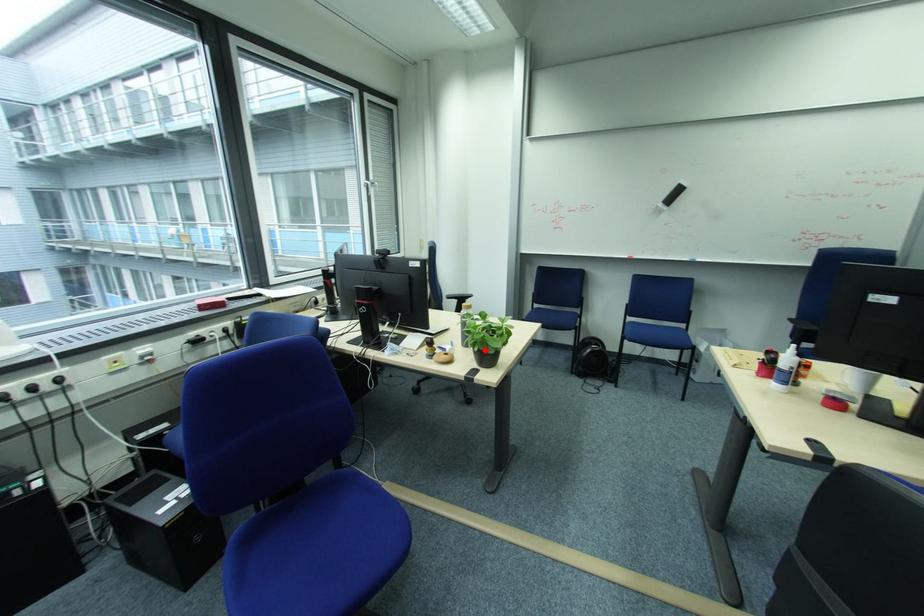
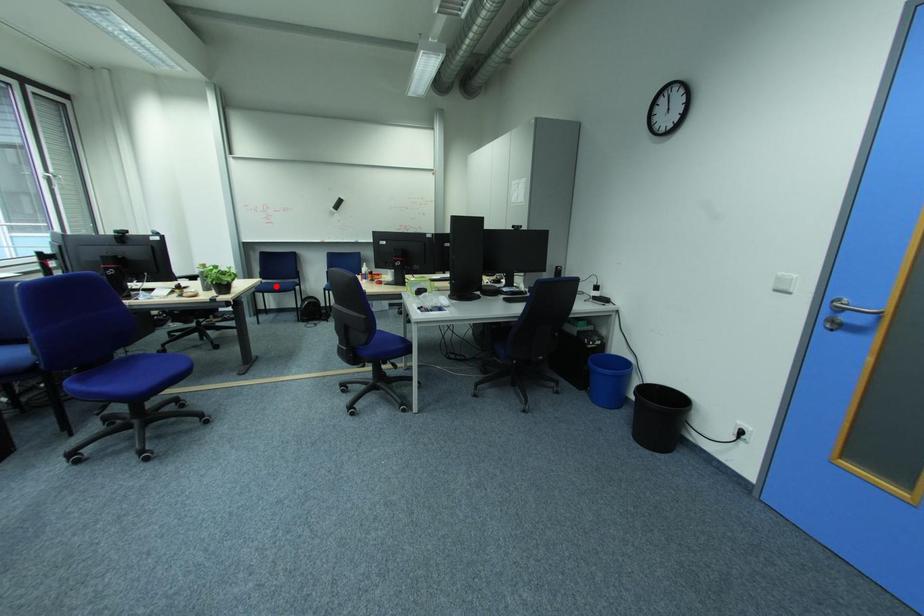
I am providing you with two images of the same scene from different viewpoints. A red point is marked on the first image and another point is marked on the second image. Are the points marked in image1 and image2 representing the same 3D position?

No